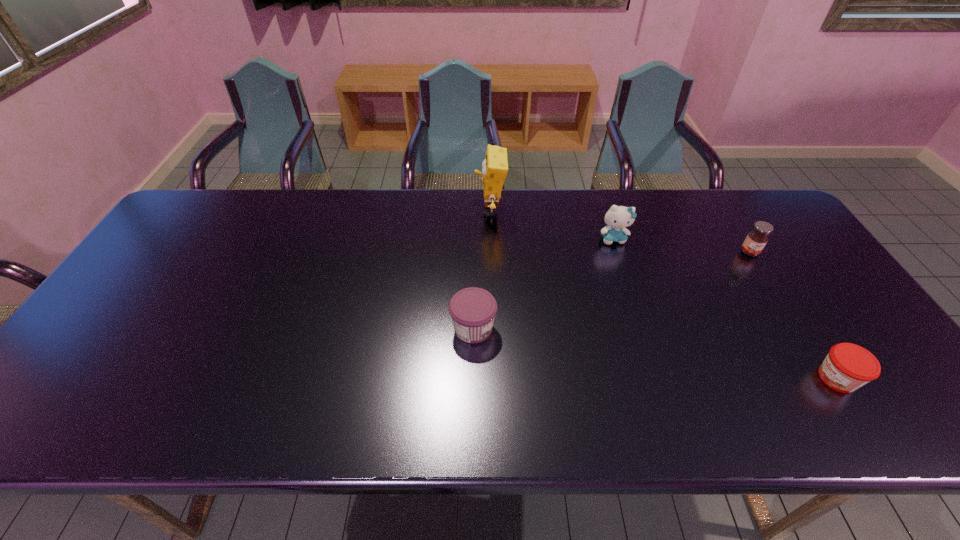
What are the coordinates of `free space located on the face of the tallest object` in the screenshot? It's located at (371, 210).

You are a GUI agent. You are given a task and a screenshot of the screen. Output one action in this format:
    pyautogui.click(x=<x>, y=<y>)
    Task: Click on the blank area located on the face of the second tallest object
    Image resolution: width=960 pixels, height=540 pixels.
    Given the screenshot: What is the action you would take?
    pyautogui.click(x=636, y=312)

Locate an element on the screen. Image resolution: width=960 pixels, height=540 pixels. vacant space located 0.080m on the label side of the farthest jam is located at coordinates click(766, 278).

Locate an element on the screen. free space located 0.050m on the front label of the second farthest jam is located at coordinates (516, 328).

Locate an element on the screen. blank space located on the label side of the shortest object is located at coordinates (667, 379).

This screenshot has width=960, height=540. Find the location of `vacant region located 0.400m on the label side of the shortest object`. vacant region located 0.400m on the label side of the shortest object is located at coordinates (641, 379).

You are a GUI agent. You are given a task and a screenshot of the screen. Output one action in this format:
    pyautogui.click(x=<x>, y=<y>)
    Task: Click on the free space located on the label side of the shortest object
    The image size is (960, 540).
    Given the screenshot: What is the action you would take?
    pyautogui.click(x=672, y=379)

Locate an element on the screen. Image resolution: width=960 pixels, height=540 pixels. sponge present at the far edge is located at coordinates (495, 165).

The width and height of the screenshot is (960, 540). Identify the location of kitten that is at the far edge. (617, 218).

This screenshot has width=960, height=540. What are the coordinates of `object that is at the near edge` in the screenshot? It's located at (847, 367).